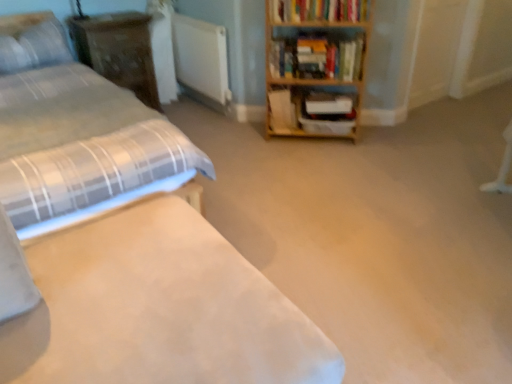
Question: Does point (270, 117) appear closer or farther from the camera than point (50, 82)?

Choices:
 (A) farther
 (B) closer

Answer: (A)

Question: Is wooden bookshelf at center, which is the third book from top to bottom, to the left or to the right of white fabric bed at left, the 1th bed when ordered from front to back, in the image?

Choices:
 (A) right
 (B) left

Answer: (A)

Question: Estimate the real-world distances between objects in this image. Which object is farther from the wooden bookshelf at center, which is the third book from top to bottom?

Choices:
 (A) wooden dresser at upper left
 (B) white fabric bed at left, marked as the first bed in a back-to-front arrangement
 (C) hardcover book at upper right, which ranks as the 1th book in top-to-bottom order
 (D) wooden shelf at center
 (E) wooden bookshelf at upper right, the 2th book positioned from the bottom

Answer: (B)

Question: Based on their relative distances, which object is nearer to the white fabric bed at left, marked as the first bed in a back-to-front arrangement?

Choices:
 (A) white textured pillow at upper left
 (B) white fabric bed at left, the 2th bed from the back
 (C) wooden bookcase at upper right
 (D) white matte radiator at center
 (E) wooden bookshelf at upper right, the second book in the top-to-bottom sequence

Answer: (B)